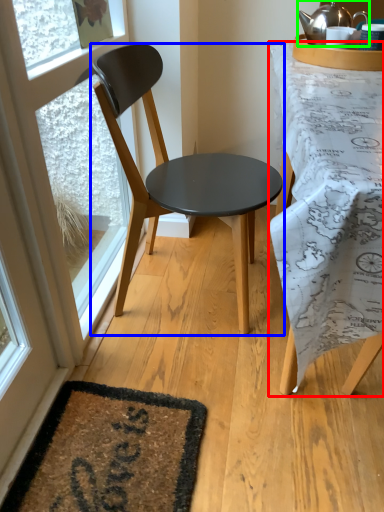
Question: Which is farther away from desk (highlighted by a red box)? chair (highlighted by a blue box) or kettle (highlighted by a green box)?

Choices:
 (A) chair
 (B) kettle

Answer: (B)